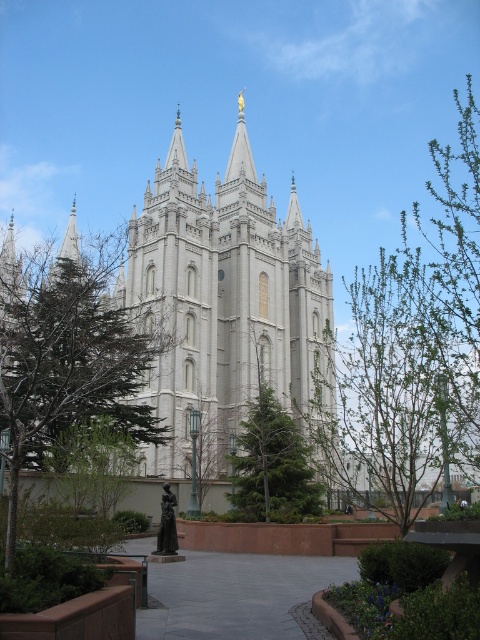
Is green leafy tree at right to the right of green textured tree at center from the viewer's perspective?

Indeed, green leafy tree at right is positioned on the right side of green textured tree at center.

Does point (447, 195) come in front of point (275, 428)?

No.

Measure the distance between point (332, 452) and camera.

Point (332, 452) is 79.75 meters from camera.

Identify the location of green leafy tree at right. This screenshot has width=480, height=640. (417, 342).

Is green leafy tree at lower left bigger than green textured tree at center?

Indeed, green leafy tree at lower left has a larger size compared to green textured tree at center.

Based on the photo, is green leafy tree at lower left shorter than green textured tree at center?

No, green leafy tree at lower left is not shorter than green textured tree at center.

Find the location of a particular element. The image size is (480, 640). green leafy tree at lower left is located at coordinates (67, 353).

Is white stone church at center bigger than green textured tree at center?

Indeed, white stone church at center has a larger size compared to green textured tree at center.

Between point (156, 218) and point (317, 488), which one is positioned behind?

The point (156, 218) is behind.

Is point (214, 323) in front of point (288, 522)?

No, (214, 323) is behind (288, 522).

Identify the location of white stone church at center. (222, 300).